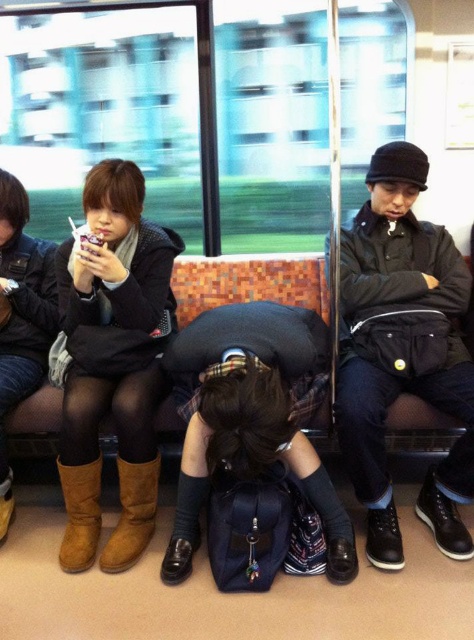
Which of these two, black leather jacket at upper right or brown suede boots at left, stands shorter?

brown suede boots at left is shorter.

The image size is (474, 640). What do you see at coordinates (402, 352) in the screenshot?
I see `black leather jacket at upper right` at bounding box center [402, 352].

Image resolution: width=474 pixels, height=640 pixels. I want to click on black leather jacket at upper right, so (402, 352).

I want to click on black leather jacket at upper right, so point(402,352).

Does black leather jacket at upper right have a lesser height compared to brown suede boot at lower center?

In fact, black leather jacket at upper right may be taller than brown suede boot at lower center.

Between point (371, 289) and point (133, 486), which one is positioned behind?

Point (371, 289)

Describe the element at coordinates (402, 352) in the screenshot. I see `black leather jacket at upper right` at that location.

You are a GUI agent. You are given a task and a screenshot of the screen. Output one action in this format:
    pyautogui.click(x=<x>, y=<y>)
    Task: Click on the black leather jacket at upper right
    
    Given the screenshot: What is the action you would take?
    pyautogui.click(x=402, y=352)

Does brown suede boots at left lie behind brown suede boot at lower center?

Yes, it is.

Does brown suede boots at left have a greater width compared to brown suede boot at lower center?

Yes.

Is point (125, 524) closer to camera compared to point (131, 544)?

That is False.

Find the location of a particular element. This screenshot has height=640, width=474. brown suede boots at left is located at coordinates (112, 362).